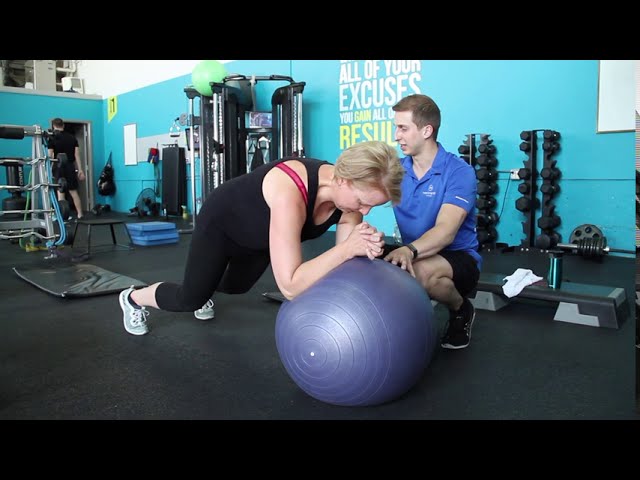
The height and width of the screenshot is (480, 640). What are the coordinates of `weight machine` in the screenshot? It's located at (244, 118).